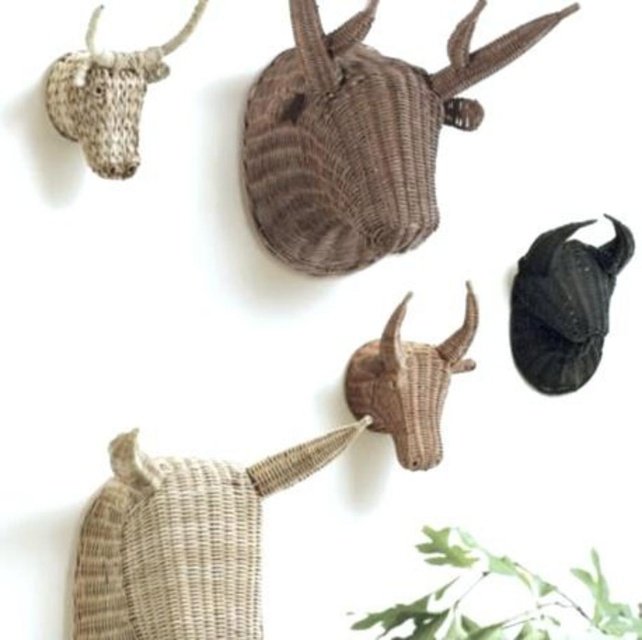
You are standing in front of the wall with animal head sculptures. There are two points marked on the wall at coordinates point (x=404, y=224) and point (x=578, y=225). Which point is closer to you?

Point (x=404, y=224) is in front of point (x=578, y=225), so it is closer to you.

You are an interior designer arranging a shelf. You have a woven beige basket at upper left and a green leafy plant at upper center. The shelf is 15 inches wide. Can both items fit side by side without overlapping?

The woven beige basket at upper left is 12.58 inches away from the green leafy plant at upper center, so they can fit side by side on a 15 inch wide shelf since the total space needed is less than 15 inches.

You are standing in front of a wall with two items displayed. You see a woven beige basket at upper left and a green leafy plant at upper center. Which item is positioned higher on the wall?

The woven beige basket at upper left is positioned higher on the wall than the green leafy plant at upper center because it is located above it.